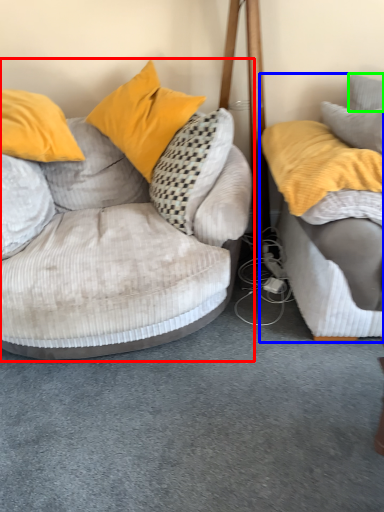
Question: Which object is positioned farthest from studio couch (highlighted by a red box)? Select from studio couch (highlighted by a blue box) and pillow (highlighted by a green box).

Choices:
 (A) studio couch
 (B) pillow

Answer: (B)